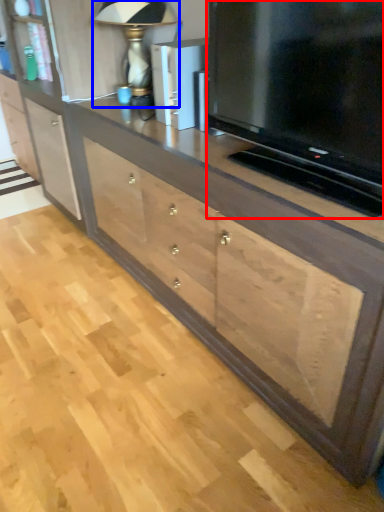
Question: Which point is further to the camera, television (highlighted by a red box) or table lamp (highlighted by a blue box)?

Choices:
 (A) television
 (B) table lamp

Answer: (B)